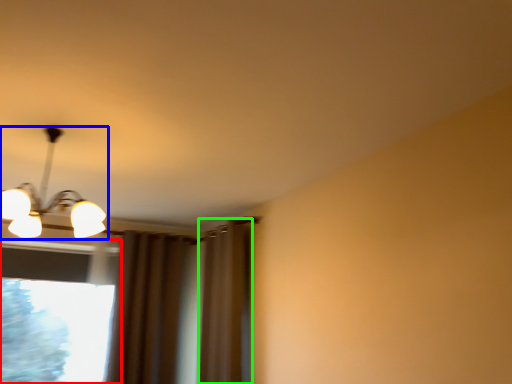
Question: Which object is the farthest from window (highlighted by a red box)? Choose among these: lamp (highlighted by a blue box) or curtain (highlighted by a green box).

Choices:
 (A) lamp
 (B) curtain

Answer: (B)